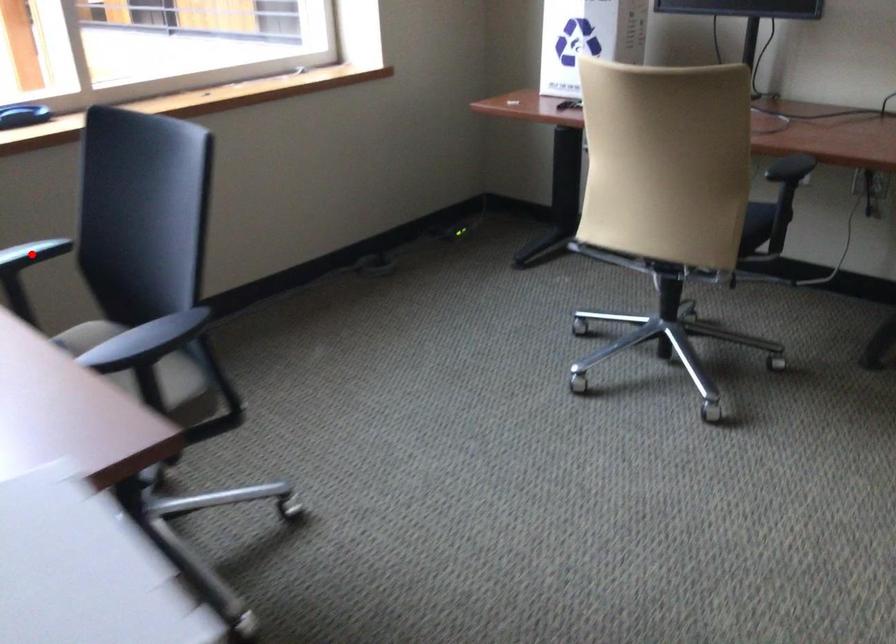
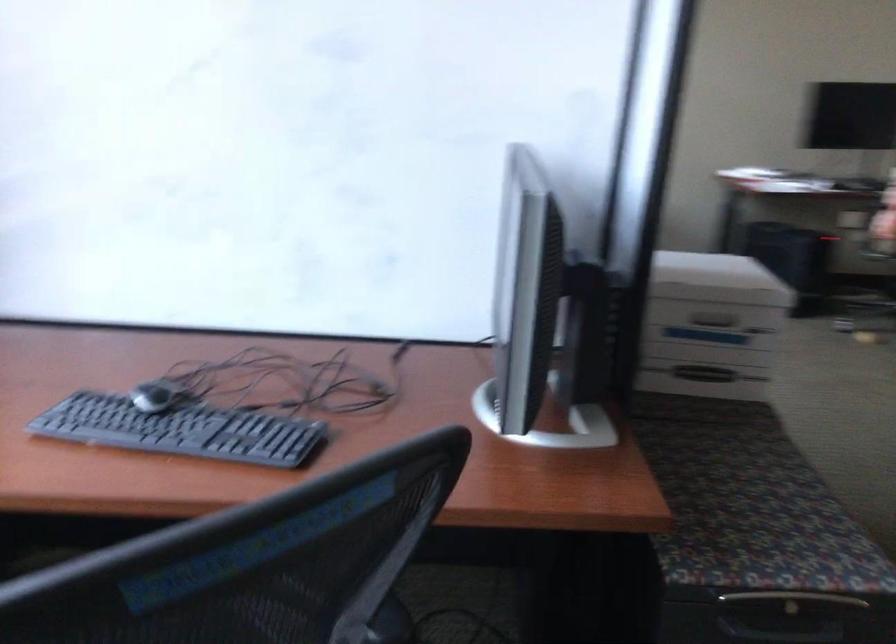
Question: I am providing you with two images of the same scene from different viewpoints. A red point is marked on the first image. At the location where the point appears in image 1, is it still visible in image 2?

Choices:
 (A) Yes
 (B) No

Answer: (B)